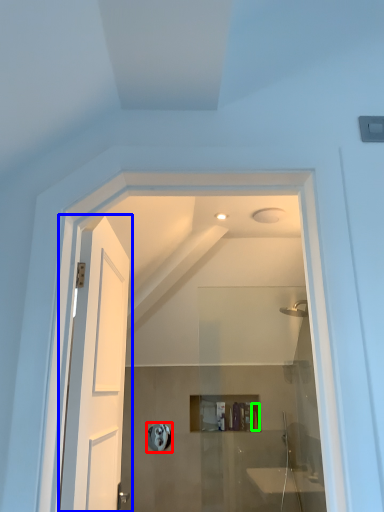
Question: Estimate the real-world distances between objects in this image. Which object is farther from towel bar (highlighted by a red box), door (highlighted by a blue box) or toiletry (highlighted by a green box)?

Choices:
 (A) door
 (B) toiletry

Answer: (A)